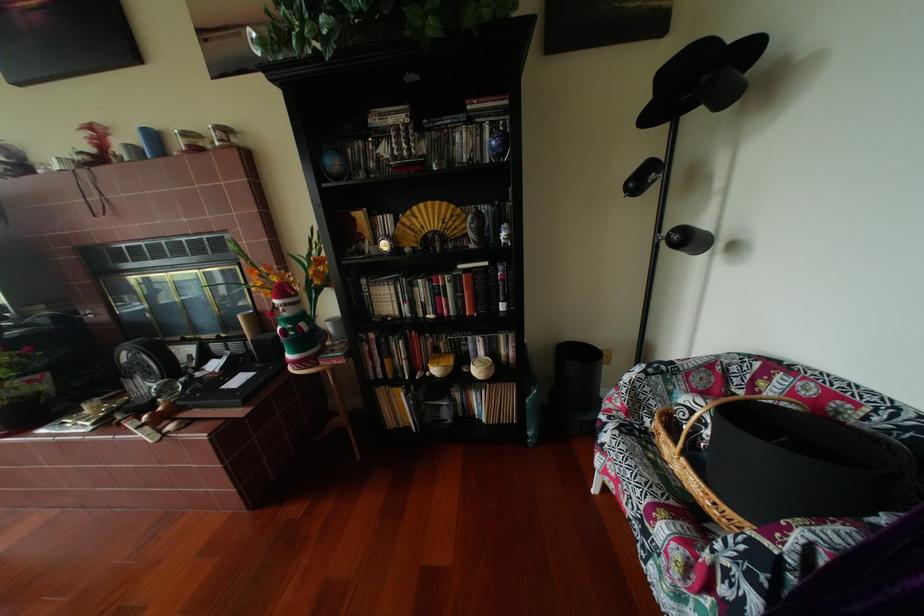
You are a GUI agent. You are given a task and a screenshot of the screen. Output one action in this format:
    pyautogui.click(x=<x>, y=<y>)
    Task: Click on the glass vase
    The width and height of the screenshot is (924, 616).
    Given the screenshot: What is the action you would take?
    pyautogui.click(x=295, y=328)